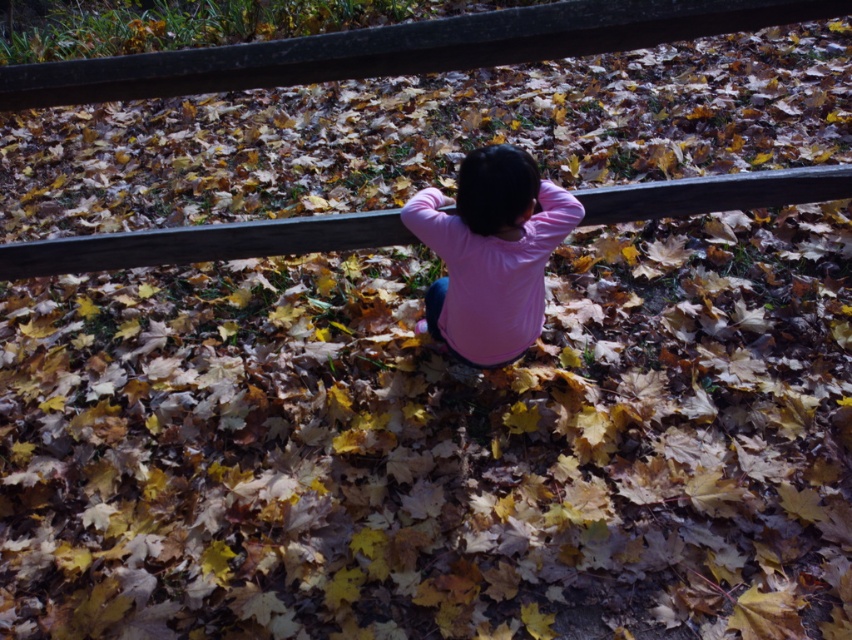
Question: Which of the following is the closest to the observer?

Choices:
 (A) pink matte shirt at center
 (B) wooden rail at center

Answer: (A)

Question: Does pink matte shirt at center appear on the right side of wooden rail at center?

Choices:
 (A) no
 (B) yes

Answer: (B)

Question: Does pink matte shirt at center have a lesser width compared to wooden rail at center?

Choices:
 (A) no
 (B) yes

Answer: (B)

Question: Does pink matte shirt at center come in front of wooden rail at center?

Choices:
 (A) yes
 (B) no

Answer: (A)